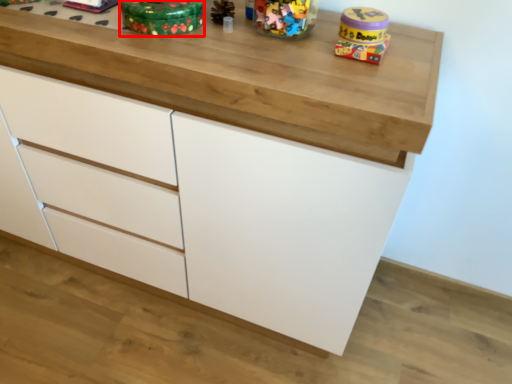
Question: From the image's perspective, what is the correct spatial positioning of toy (annotated by the red box) in reference to toy?

Choices:
 (A) above
 (B) below

Answer: (A)